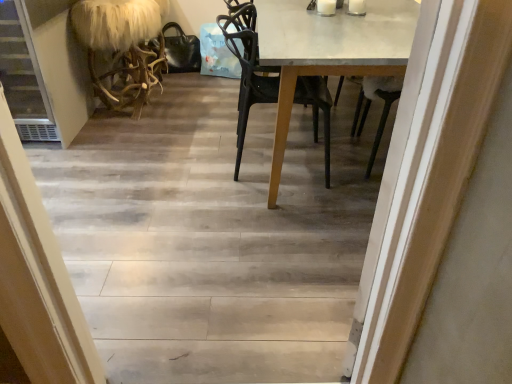
Image resolution: width=512 pixels, height=384 pixels. I want to click on vacant space in front of white glossy table at center, so click(238, 261).